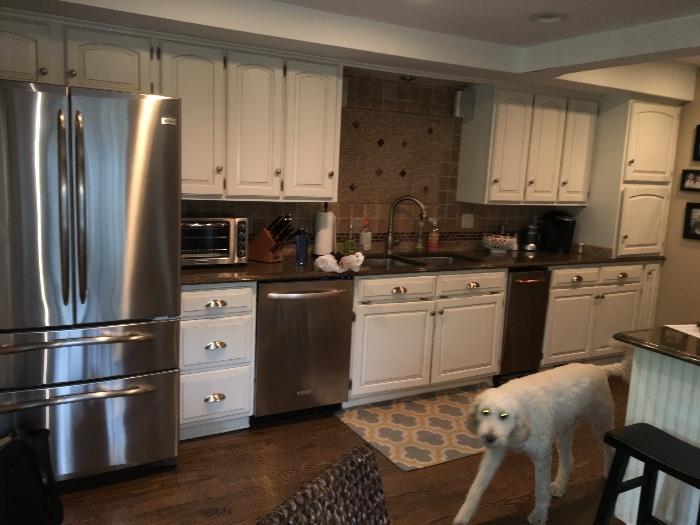
Identify the location of paper towel roll. (325, 229).